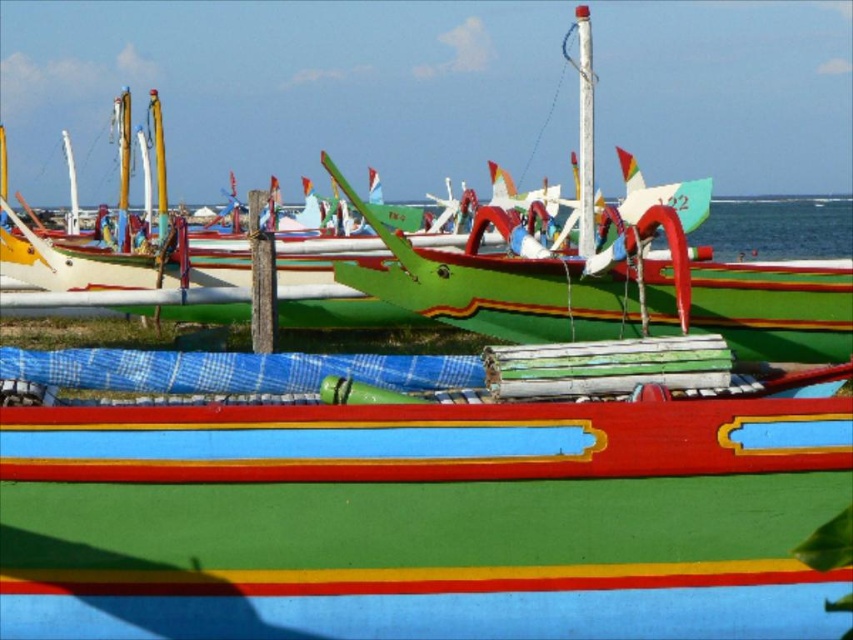
You are a photographer standing at the shoreline and want to capture both the green painted wood boat at center and the smooth plastic line at lower center in your photo. Which object will appear taller in the photo?

The green painted wood boat at center will appear taller in the photo because it has a greater height compared to the smooth plastic line at lower center.

You are standing on the shore and see the green painted wood boat at center and the smooth plastic line at lower center. Which object is closer to you?

The green painted wood boat at center is closer to you because it is further to the viewer than the smooth plastic line at lower center.